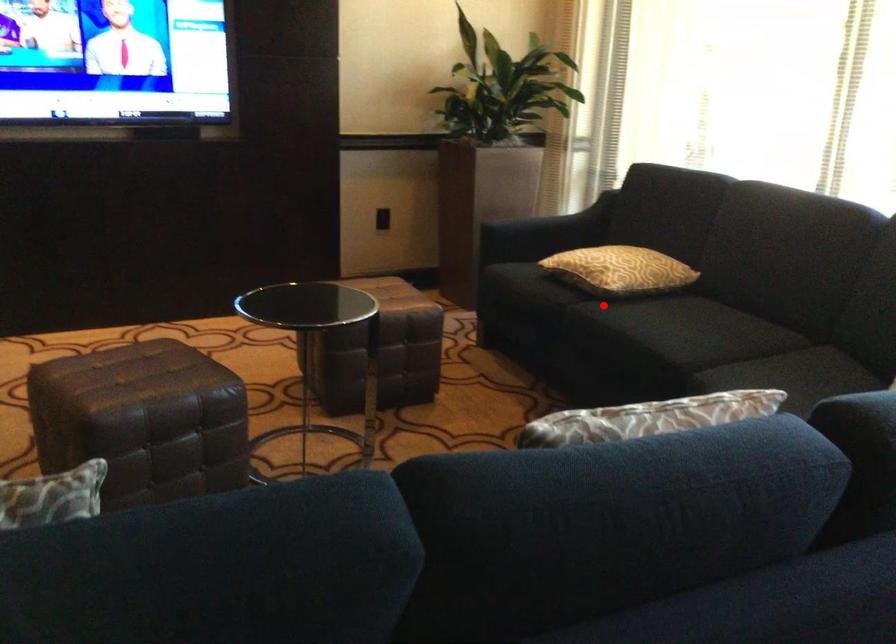
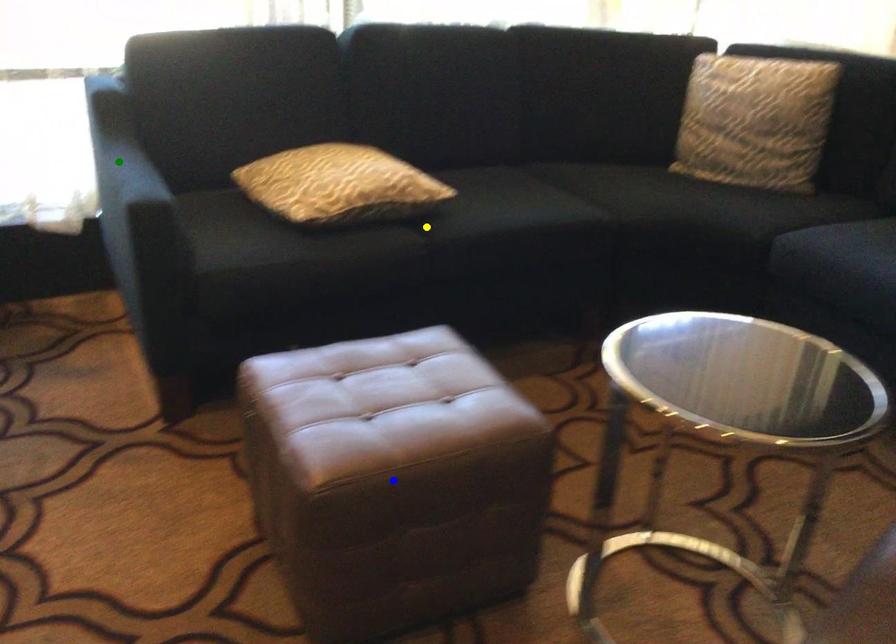
Question: I am providing you with two images of the same scene from different viewpoints. A red point is marked on the first image. You are given multiple points on the second image. Which point in image 2 represents the same 3d spot as the red point in image 1?

Choices:
 (A) green point
 (B) yellow point
 (C) blue point

Answer: (B)